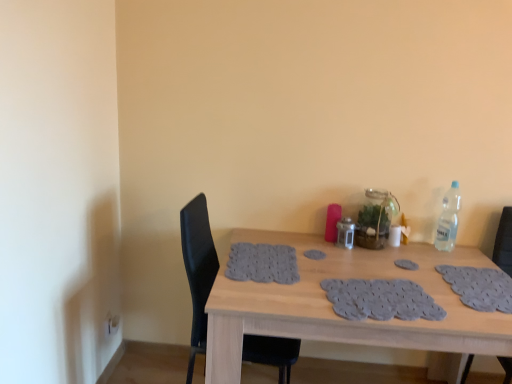
This screenshot has height=384, width=512. I want to click on free area in between gray fabric footprint at center, which ranks as the 1th footprint in top-to-bottom order, and gray fabric placemat at center, placed as the second footprint when sorted from left to right, so click(366, 260).